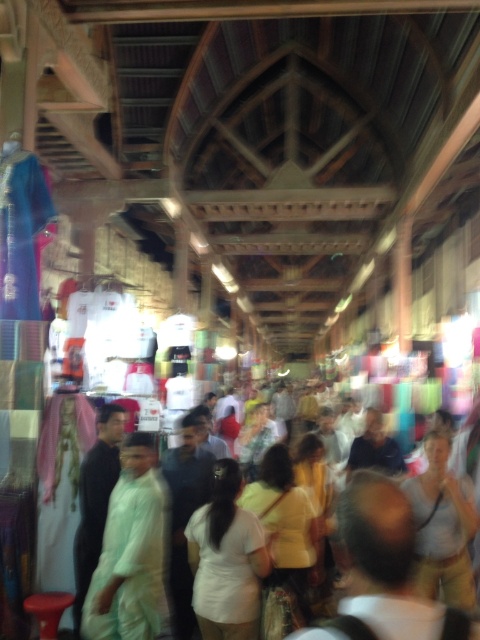
From the picture: You are a photographer standing in the market and want to take a photo of the white matte shirt at center without the white cotton crowd at center blocking it. What should you do?

Move the camera upwards so that the white matte shirt at center is no longer obscured by the white cotton crowd at center, which is positioned below it.

You are a vendor in the market and want to hand a light green fabric at center to a customer standing near the white matte shirt at center. Can you reach them without moving closer?

The light green fabric at center is 17.65 inches away from the white matte shirt at center. Since this distance is within typical reaching range, you can likely hand the light green fabric at center to the customer without needing to move closer.